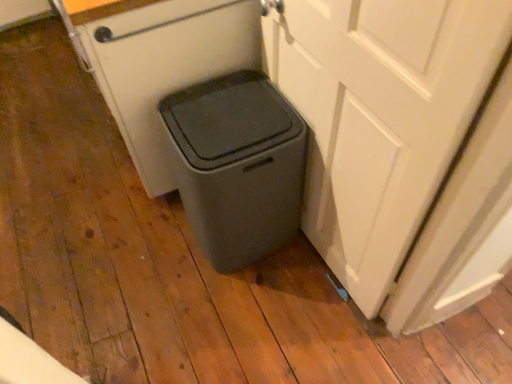
Question: Based on their sizes in the image, would you say matte gray trash can at lower center is bigger or smaller than white matte door at right?

Choices:
 (A) big
 (B) small

Answer: (A)

Question: Is point (302, 167) closer or farther from the camera than point (361, 281)?

Choices:
 (A) closer
 (B) farther

Answer: (B)

Question: Considering the positions of matte gray trash can at lower center and white matte door at right in the image, is matte gray trash can at lower center taller or shorter than white matte door at right?

Choices:
 (A) short
 (B) tall

Answer: (A)

Question: Considering the positions of white matte door at right and matte gray trash can at lower center in the image, is white matte door at right taller or shorter than matte gray trash can at lower center?

Choices:
 (A) tall
 (B) short

Answer: (A)

Question: Looking at their shapes, would you say white matte door at right is wider or thinner than matte gray trash can at lower center?

Choices:
 (A) wide
 (B) thin

Answer: (B)

Question: Based on their sizes in the image, would you say white matte door at right is bigger or smaller than matte gray trash can at lower center?

Choices:
 (A) big
 (B) small

Answer: (B)

Question: From a real-world perspective, relative to matte gray trash can at lower center, is white matte door at right vertically above or below?

Choices:
 (A) above
 (B) below

Answer: (A)